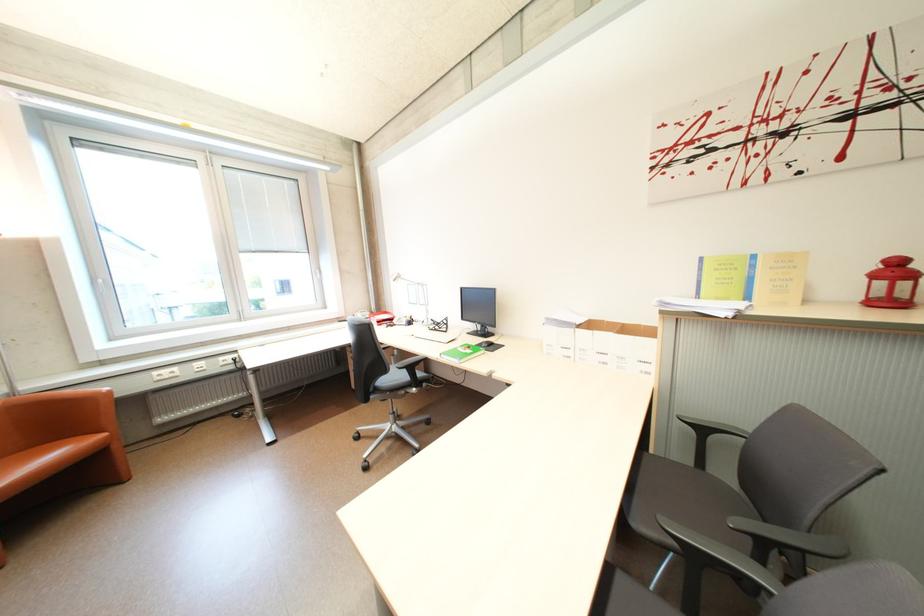
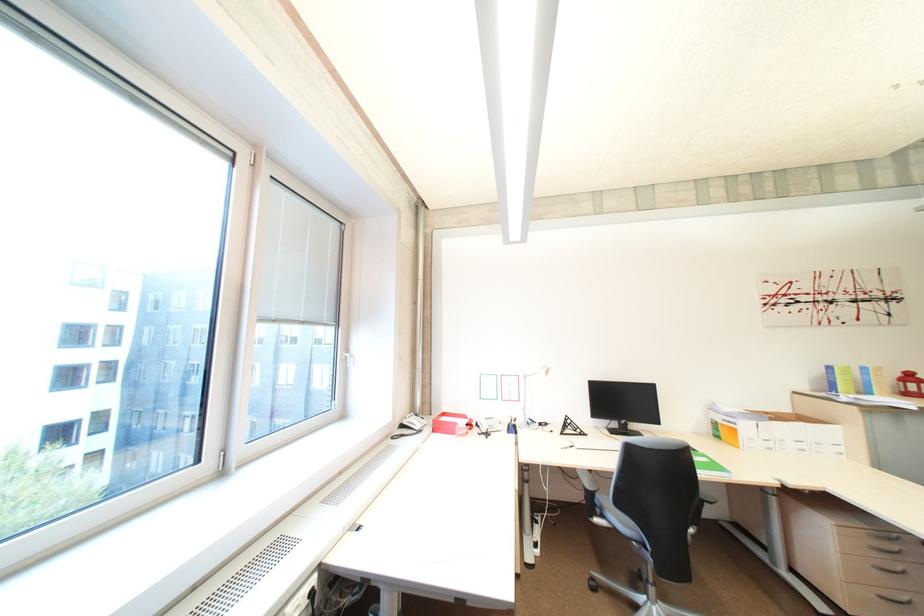
In the second image, find the point that corresponds to (395,313) in the first image.

(454, 415)